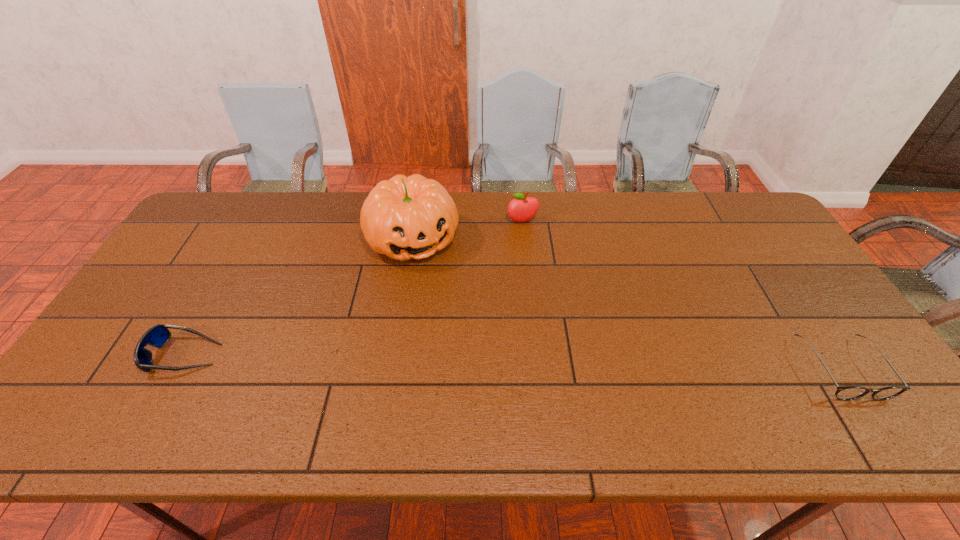
Locate an element on the screen. The width and height of the screenshot is (960, 540). sunglasses is located at coordinates (157, 336).

Locate an element on the screen. the shortest object is located at coordinates (845, 393).

Locate an element on the screen. This screenshot has width=960, height=540. spectacles is located at coordinates tap(845, 393).

Find the location of `the second object from right to left`. the second object from right to left is located at coordinates (521, 209).

I want to click on apple, so click(x=521, y=209).

Identify the location of the tallest object. (404, 218).

Identify the location of pumpkin. This screenshot has height=540, width=960. (404, 218).

You are a GUI agent. You are given a task and a screenshot of the screen. Output one action in this format:
    pyautogui.click(x=<x>, y=<y>)
    Task: Click on the vacant space located on the front-facing side of the sunglasses
    The height and width of the screenshot is (540, 960).
    Given the screenshot: What is the action you would take?
    pyautogui.click(x=100, y=355)

The image size is (960, 540). Identify the location of free space located on the front-facing side of the sunglasses. (128, 355).

Where is `free space located 0.400m on the front-facing side of the apple`? free space located 0.400m on the front-facing side of the apple is located at coordinates (550, 320).